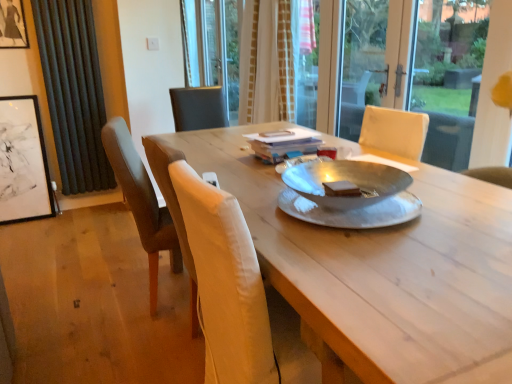
Identify the location of matte black picture frame at upper left, arranged as the 1th picture frame when viewed from the top. Image resolution: width=512 pixels, height=384 pixels. (12, 25).

In order to face matte black picture frame at upper left, placed as the 2th picture frame when sorted from bottom to top, should I rotate leftwards or rightwards?

Turn left approximately 30.779 degrees to face it.

Where is `black matte picture frame at left, the 2th picture frame from the top`? black matte picture frame at left, the 2th picture frame from the top is located at coordinates (23, 162).

What do you see at coordinates (23, 162) in the screenshot? The width and height of the screenshot is (512, 384). I see `black matte picture frame at left, the 2th picture frame from the top` at bounding box center [23, 162].

How much space does white textured curtain at center, which is the second curtain from left to right, occupy vertically?

It is 4.01 feet.

Describe the element at coordinates (279, 62) in the screenshot. The height and width of the screenshot is (384, 512). I see `white textured curtain at center, which is counted as the first curtain, starting from the right` at that location.

What is the approximate width of transparent glass screen door at upper center?

It is 4.55 centimeters.

Consider the image. In order to face dark grey fabric curtain at left, which appears as the 1th curtain when viewed from the left, should I rotate leftwards or rightwards?

Turn left approximately 22.819 degrees to face it.

Identify the location of matte black picture frame at upper left, arranged as the 1th picture frame when viewed from the top. The width and height of the screenshot is (512, 384). (12, 25).

Considering the positions of objects white textured curtain at center, which is the second curtain from left to right, and dark grey fabric curtain at left, positioned as the second curtain in right-to-left order, in the image provided, who is more to the left, white textured curtain at center, which is the second curtain from left to right, or dark grey fabric curtain at left, positioned as the second curtain in right-to-left order,?

dark grey fabric curtain at left, positioned as the second curtain in right-to-left order.

Are white textured curtain at center, which is counted as the first curtain, starting from the right, and dark grey fabric curtain at left, which appears as the 1th curtain when viewed from the left, beside each other?

white textured curtain at center, which is counted as the first curtain, starting from the right, and dark grey fabric curtain at left, which appears as the 1th curtain when viewed from the left, are not in contact.

Is white textured curtain at center, which is counted as the first curtain, starting from the right, looking in the opposite direction of dark grey fabric curtain at left, positioned as the second curtain in right-to-left order?

No, dark grey fabric curtain at left, positioned as the second curtain in right-to-left order, is not at the back of white textured curtain at center, which is counted as the first curtain, starting from the right.

How many degrees apart are the facing directions of white textured curtain at center, which is counted as the first curtain, starting from the right, and dark grey fabric curtain at left, which appears as the 1th curtain when viewed from the left?

The angular difference between white textured curtain at center, which is counted as the first curtain, starting from the right, and dark grey fabric curtain at left, which appears as the 1th curtain when viewed from the left, is 89.1 degrees.

Choose the correct answer: Is transparent glass screen door at upper center inside matte black picture frame at upper left, placed as the 2th picture frame when sorted from bottom to top, or outside it?

transparent glass screen door at upper center is spatially situated outside matte black picture frame at upper left, placed as the 2th picture frame when sorted from bottom to top.

Consider the image. From the image's perspective, between transparent glass screen door at upper center and matte black picture frame at upper left, placed as the 2th picture frame when sorted from bottom to top, which one is located above?

matte black picture frame at upper left, placed as the 2th picture frame when sorted from bottom to top, appears higher in the image.

Measure the distance from transparent glass screen door at upper center to matte black picture frame at upper left, placed as the 2th picture frame when sorted from bottom to top.

They are 2.96 meters apart.

From a real-world perspective, is transparent glass screen door at upper center located beneath matte black picture frame at upper left, arranged as the 1th picture frame when viewed from the top?

Yes, from a real-world perspective, transparent glass screen door at upper center is beneath matte black picture frame at upper left, arranged as the 1th picture frame when viewed from the top.

Can we say white textured curtain at center, which is counted as the first curtain, starting from the right, lies outside wooden table at center?

Yes, white textured curtain at center, which is counted as the first curtain, starting from the right, is located beyond the bounds of wooden table at center.

Does point (314, 93) come in front of point (288, 277)?

No.

Between white textured curtain at center, which is counted as the first curtain, starting from the right, and wooden table at center, which one has larger size?

Bigger between the two is wooden table at center.

Is white textured curtain at center, which is counted as the first curtain, starting from the right, to the right of wooden table at center from the viewer's perspective?

No, white textured curtain at center, which is counted as the first curtain, starting from the right, is not to the right of wooden table at center.

Is dark grey fabric curtain at left, positioned as the second curtain in right-to-left order, thinner than black matte picture frame at left, the 2th picture frame from the top?

Indeed, dark grey fabric curtain at left, positioned as the second curtain in right-to-left order, has a lesser width compared to black matte picture frame at left, the 2th picture frame from the top.

Is black matte picture frame at left, the 2th picture frame from the top, a part of dark grey fabric curtain at left, which appears as the 1th curtain when viewed from the left?

No, black matte picture frame at left, the 2th picture frame from the top, is not a part of dark grey fabric curtain at left, which appears as the 1th curtain when viewed from the left.

Is dark grey fabric curtain at left, which appears as the 1th curtain when viewed from the left, next to black matte picture frame at left, the 2th picture frame from the top?

No, dark grey fabric curtain at left, which appears as the 1th curtain when viewed from the left, is not in contact with black matte picture frame at left, the 2th picture frame from the top.

From the image's perspective, who appears lower, dark grey fabric curtain at left, which appears as the 1th curtain when viewed from the left, or black matte picture frame at left, positioned as the first picture frame in bottom-to-top order?

black matte picture frame at left, positioned as the first picture frame in bottom-to-top order, is shown below in the image.

Which is closer, (344, 51) or (253, 6)?

Point (344, 51) is farther from the camera than point (253, 6).

Does transparent glass screen door at upper center appear on the left side of white textured curtain at center, which is the second curtain from left to right?

Incorrect, transparent glass screen door at upper center is not on the left side of white textured curtain at center, which is the second curtain from left to right.

Is transparent glass screen door at upper center wider than white textured curtain at center, which is the second curtain from left to right?

In fact, transparent glass screen door at upper center might be narrower than white textured curtain at center, which is the second curtain from left to right.

Could white textured curtain at center, which is counted as the first curtain, starting from the right, be considered to be inside transparent glass screen door at upper center?

No, white textured curtain at center, which is counted as the first curtain, starting from the right, is not inside transparent glass screen door at upper center.

What's the angular difference between wooden table at center and white textured curtain at center, which is the second curtain from left to right,'s facing directions?

2.24 degrees separate the facing orientations of wooden table at center and white textured curtain at center, which is the second curtain from left to right.

Considering the relative positions of wooden table at center and white textured curtain at center, which is the second curtain from left to right, in the image provided, is wooden table at center to the left or to the right of white textured curtain at center, which is the second curtain from left to right,?

From the image, it's evident that wooden table at center is to the right of white textured curtain at center, which is the second curtain from left to right.

Relative to white textured curtain at center, which is the second curtain from left to right, is wooden table at center in front or behind?

Visually, wooden table at center is located in front of white textured curtain at center, which is the second curtain from left to right.

Measure the distance from wooden table at center to white textured curtain at center, which is counted as the first curtain, starting from the right.

A distance of 7.64 feet exists between wooden table at center and white textured curtain at center, which is counted as the first curtain, starting from the right.

From a real-world perspective, is brown leather chair at left physically located above or below wooden table at center?

brown leather chair at left is situated higher than wooden table at center in the real world.

Which is more to the left, brown leather chair at left or wooden table at center?

Positioned to the left is brown leather chair at left.

From the image's perspective, which one is positioned lower, brown leather chair at left or wooden table at center?

wooden table at center appears lower in the image.

Is brown leather chair at left shorter than wooden table at center?

In fact, brown leather chair at left may be taller than wooden table at center.

What are the coordinates of `curtain on the right of dark grey fabric curtain at left, positioned as the second curtain in right-to-left order` in the screenshot? It's located at (279, 62).

Identify the location of screen door in front of the matte black picture frame at upper left, placed as the 2th picture frame when sorted from bottom to top. (369, 60).

Based on the photo, estimate the real-world distances between objects in this image. Which object is further from matte black picture frame at upper left, arranged as the 1th picture frame when viewed from the top, transparent glass screen door at upper center or wooden table at center?

transparent glass screen door at upper center lies further to matte black picture frame at upper left, arranged as the 1th picture frame when viewed from the top, than the other object.

Which object lies nearer to the anchor point black matte picture frame at left, positioned as the first picture frame in bottom-to-top order, brown leather chair at left or dark grey fabric curtain at left, positioned as the second curtain in right-to-left order?

dark grey fabric curtain at left, positioned as the second curtain in right-to-left order.

When comparing their distances from black matte picture frame at left, the 2th picture frame from the top, does transparent glass screen door at upper center or dark grey fabric curtain at left, which appears as the 1th curtain when viewed from the left, seem further?

Among the two, transparent glass screen door at upper center is located further to black matte picture frame at left, the 2th picture frame from the top.

From the image, which object appears to be farther from black matte picture frame at left, positioned as the first picture frame in bottom-to-top order, dark grey fabric curtain at left, positioned as the second curtain in right-to-left order, or matte black picture frame at upper left, arranged as the 1th picture frame when viewed from the top?

The object further to black matte picture frame at left, positioned as the first picture frame in bottom-to-top order, is matte black picture frame at upper left, arranged as the 1th picture frame when viewed from the top.

Based on their spatial positions, is transparent glass screen door at upper center or brown leather chair at left further from black matte picture frame at left, positioned as the first picture frame in bottom-to-top order?

The object further to black matte picture frame at left, positioned as the first picture frame in bottom-to-top order, is transparent glass screen door at upper center.

Based on their spatial positions, is white textured curtain at center, which is counted as the first curtain, starting from the right, or brown leather chair at left further from wooden table at center?

Among the two, white textured curtain at center, which is counted as the first curtain, starting from the right, is located further to wooden table at center.

Estimate the real-world distances between objects in this image. Which object is further from wooden table at center, brown leather chair at left or dark grey fabric curtain at left, which appears as the 1th curtain when viewed from the left?

The object further to wooden table at center is dark grey fabric curtain at left, which appears as the 1th curtain when viewed from the left.

Considering their positions, is wooden table at center positioned closer to white textured curtain at center, which is the second curtain from left to right, than brown leather chair at left?

brown leather chair at left.

Identify the location of curtain between black matte picture frame at left, the 2th picture frame from the top, and brown leather chair at left from left to right. (73, 92).

Locate an element on the screen. picture frame between black matte picture frame at left, positioned as the first picture frame in bottom-to-top order, and white textured curtain at center, which is the second curtain from left to right, in the horizontal direction is located at coordinates (12, 25).

Image resolution: width=512 pixels, height=384 pixels. In order to click on chair positioned between wooden table at center and black matte picture frame at left, the 2th picture frame from the top, from near to far in this screenshot , I will do `click(140, 200)`.

Identify the location of chair located between black matte picture frame at left, positioned as the first picture frame in bottom-to-top order, and white textured curtain at center, which is the second curtain from left to right, in the left-right direction. Image resolution: width=512 pixels, height=384 pixels. (140, 200).